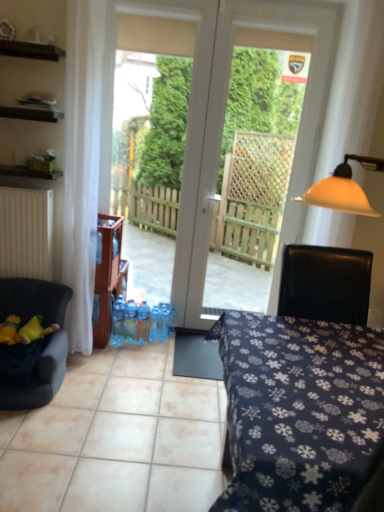
Locate an element on the screen. This screenshot has width=384, height=512. vacant space to the right of blue plastic bottle at center, the fourth bottle positioned from the right is located at coordinates (158, 346).